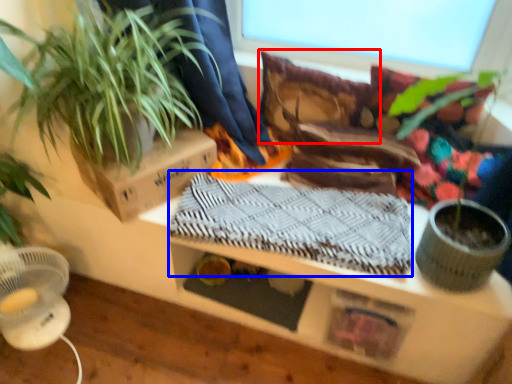
Question: Among these objects, which one is nearest to the camera, pillow (highlighted by a red box) or blanket (highlighted by a blue box)?

Choices:
 (A) pillow
 (B) blanket

Answer: (B)